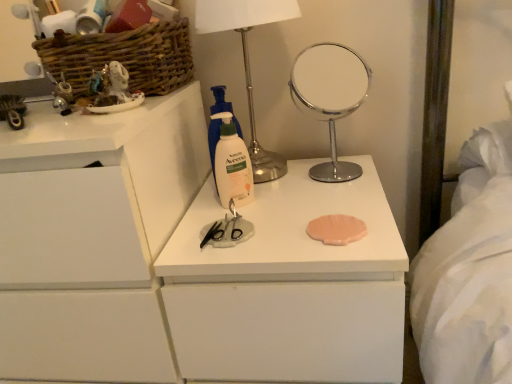
The image size is (512, 384). I want to click on vacant space to the left of matte white figurine at upper left, so click(48, 121).